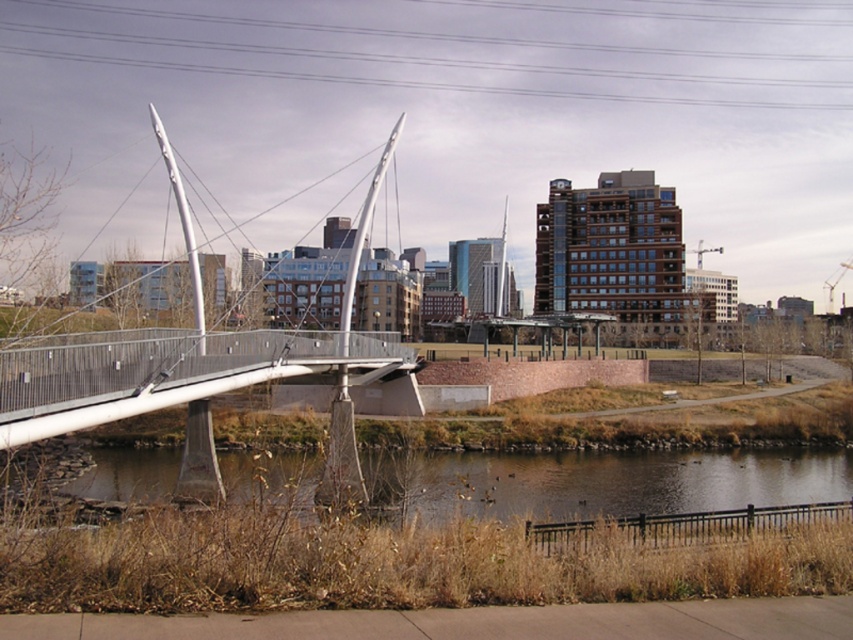
You are a drone operator planning to fly a drone from the polished steel bridge at left to the brown grassy river at lower center. Based on the scene description, which direction should you fly the drone to reach the destination?

The polished steel bridge at left is located above the brown grassy river at lower center, so you should fly the drone downward to reach the destination.

You are standing at the center of the image and want to locate the polished steel bridge at left. In which direction should you look to find it?

The polished steel bridge at left is located at point (195, 369), so you should look to the left side of the image to find it.

You are a city planner reviewing the urban layout. You need to determine if the polished steel bridge at left will block the view of the brown grassy river at lower center from the city office located on the 10th floor. Can you assess this based on the provided information?

The polished steel bridge at left is taller than the brown grassy river at lower center, so it may block the view from the city office on the 10th floor depending on the exact positioning and elevation differences between the bridge and the office.